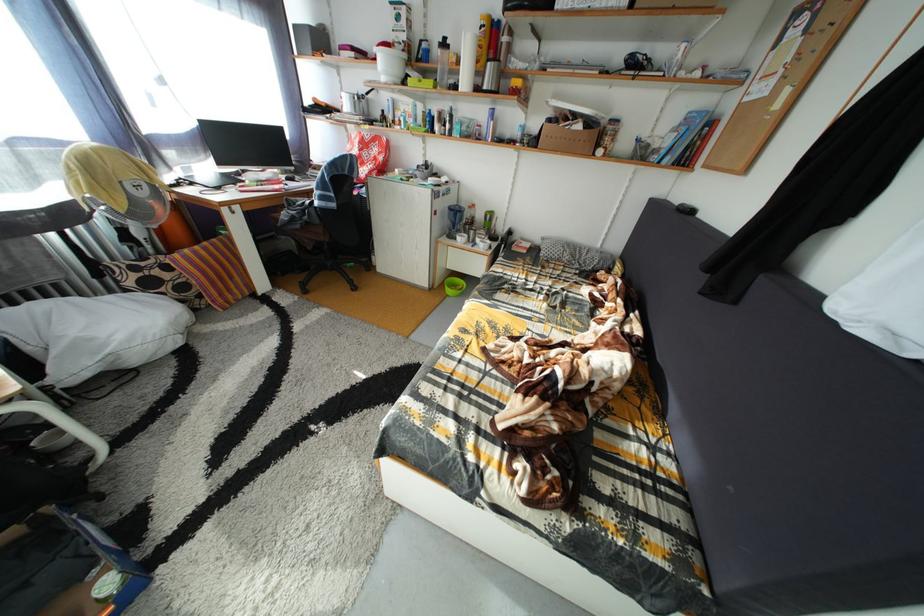
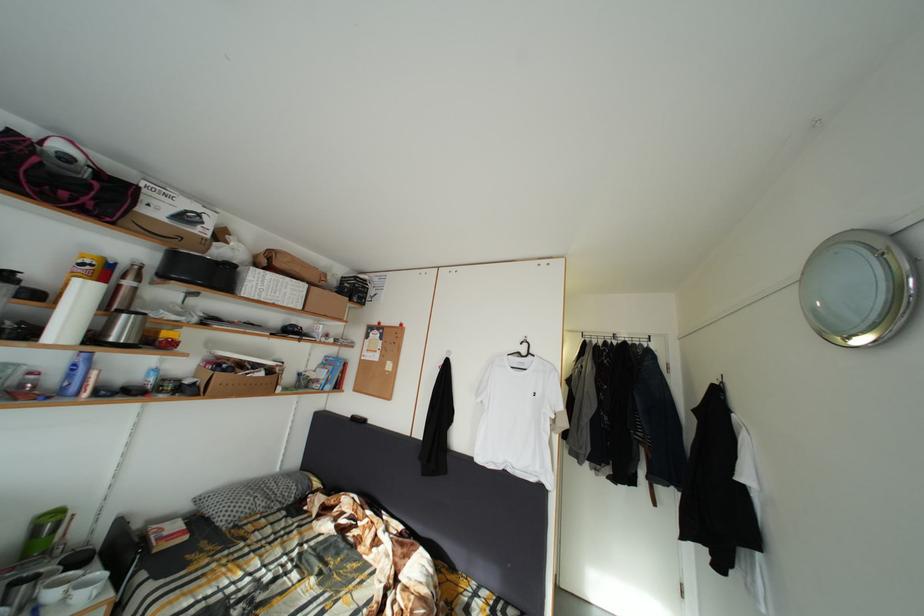
Question: The camera is either moving clockwise (left) or counter-clockwise (right) around the object. The first image is from the beginning of the video and the second image is from the end. Is the camera moving left or right when shooting the video?

Choices:
 (A) Left
 (B) Right

Answer: (A)